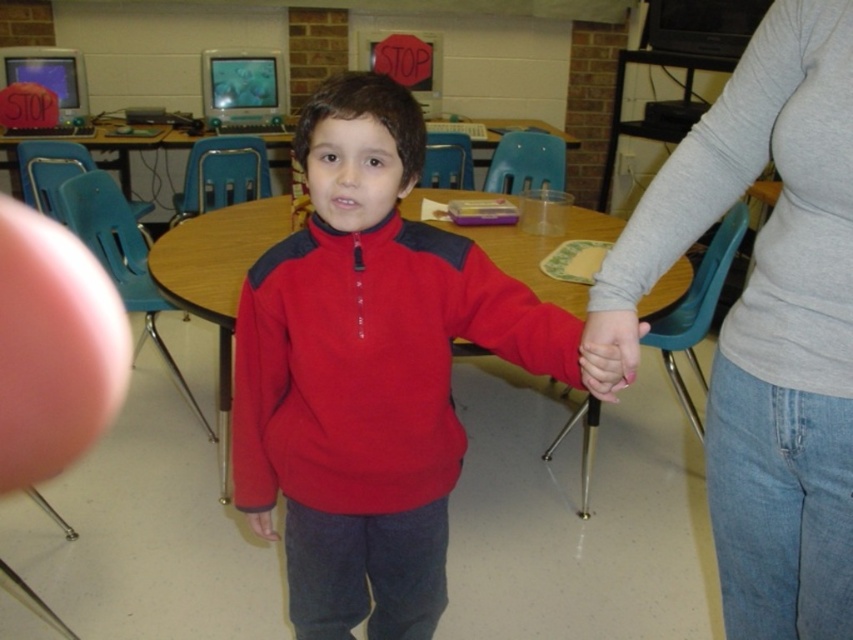
Can you confirm if gray long-sleeve shirt at upper center is positioned to the left of pink smooth skin at lower center?

No, gray long-sleeve shirt at upper center is not to the left of pink smooth skin at lower center.

Does gray long-sleeve shirt at upper center have a lesser width compared to pink smooth skin at lower center?

In fact, gray long-sleeve shirt at upper center might be wider than pink smooth skin at lower center.

The image size is (853, 640). What do you see at coordinates (770, 321) in the screenshot? I see `gray long-sleeve shirt at upper center` at bounding box center [770, 321].

Locate an element on the screen. gray long-sleeve shirt at upper center is located at coordinates (770, 321).

Is matte fleece sweater at center thinner than pink smooth skin at lower center?

Incorrect, matte fleece sweater at center's width is not less than pink smooth skin at lower center's.

Can you confirm if matte fleece sweater at center is shorter than pink smooth skin at lower center?

In fact, matte fleece sweater at center may be taller than pink smooth skin at lower center.

Is point (370, 508) more distant than point (583, 346)?

Yes, point (370, 508) is behind point (583, 346).

I want to click on matte fleece sweater at center, so click(x=368, y=371).

Can you confirm if matte fleece sweater at center is wider than gray long-sleeve shirt at upper center?

Yes, matte fleece sweater at center is wider than gray long-sleeve shirt at upper center.

Who is more forward, (299, 340) or (833, 90)?

Positioned in front is point (833, 90).

The width and height of the screenshot is (853, 640). Find the location of `matte fleece sweater at center`. matte fleece sweater at center is located at coordinates (368, 371).

Locate an element on the screen. This screenshot has height=640, width=853. matte fleece sweater at center is located at coordinates (368, 371).